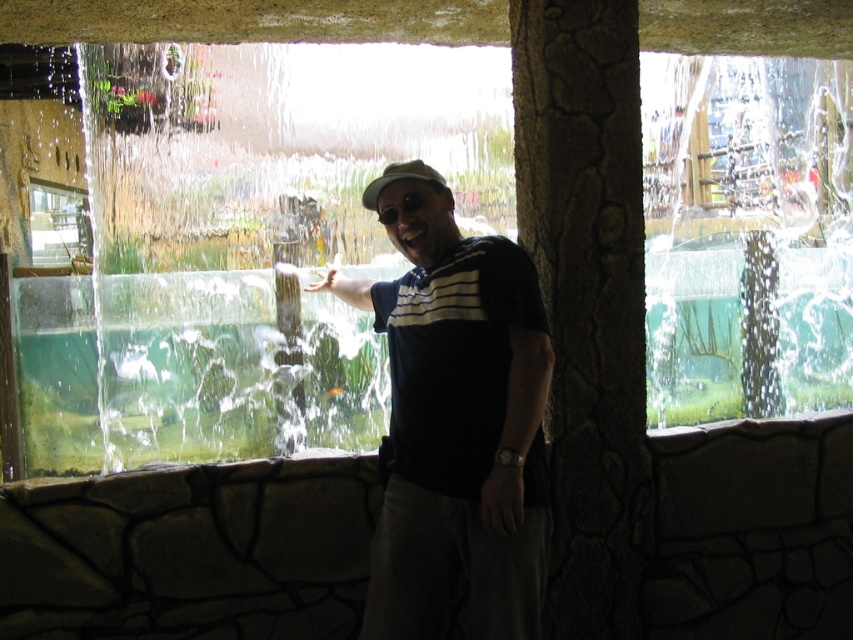
Question: Can you confirm if clear glass water at center is thinner than clear glass window at center?

Choices:
 (A) yes
 (B) no

Answer: (A)

Question: Where is clear glass water at center located in relation to clear glass window at center in the image?

Choices:
 (A) left
 (B) right

Answer: (B)

Question: Which point is closer to the camera?

Choices:
 (A) (33, 188)
 (B) (373, 90)

Answer: (B)

Question: Which point is farther to the camera?

Choices:
 (A) (39, 234)
 (B) (444, 182)

Answer: (A)

Question: Does matte black polo shirt at center appear over beige fabric baseball cap at center?

Choices:
 (A) no
 (B) yes

Answer: (A)

Question: Which point appears farthest from the camera in this image?

Choices:
 (A) (398, 440)
 (B) (164, 52)

Answer: (B)